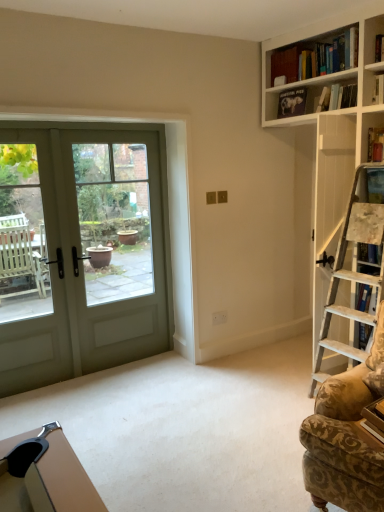
Question: In which direction should I rotate to look at matte black book at upper center, the 2th book from the bottom?

Choices:
 (A) left
 (B) right

Answer: (B)

Question: Would you consider hardcover book at upper right, which ranks as the first book in bottom-to-top order, to be distant from green matte door at left?

Choices:
 (A) no
 (B) yes

Answer: (B)

Question: Does hardcover book at upper right, the 2th book when ordered from top to bottom, have a lesser width compared to green matte door at left?

Choices:
 (A) no
 (B) yes

Answer: (A)

Question: Could you tell me if hardcover book at upper right, acting as the 2th book starting from the left, is facing green matte door at left?

Choices:
 (A) yes
 (B) no

Answer: (B)

Question: Can green matte door at left be found inside hardcover book at upper right, which appears as the first book when viewed from the right?

Choices:
 (A) yes
 (B) no

Answer: (B)

Question: Is hardcover book at upper right, marked as the second book in a back-to-front arrangement, facing away from green matte door at left?

Choices:
 (A) no
 (B) yes

Answer: (A)

Question: Is hardcover book at upper right, the 2th book when ordered from top to bottom, not within green matte door at left?

Choices:
 (A) no
 (B) yes

Answer: (B)

Question: Is patterned fabric rocking chair at right located within hardcover book at upper right, marked as the second book in a back-to-front arrangement?

Choices:
 (A) yes
 (B) no

Answer: (B)

Question: Is hardcover book at upper right, the 1th book positioned from the front, next to patterned fabric rocking chair at right and touching it?

Choices:
 (A) no
 (B) yes

Answer: (A)

Question: Is hardcover book at upper right, which ranks as the first book in bottom-to-top order, oriented towards patterned fabric rocking chair at right?

Choices:
 (A) no
 (B) yes

Answer: (A)

Question: Is hardcover book at upper right, marked as the second book in a back-to-front arrangement, to the left of patterned fabric rocking chair at right from the viewer's perspective?

Choices:
 (A) no
 (B) yes

Answer: (A)

Question: Is hardcover book at upper right, which ranks as the first book in bottom-to-top order, thinner than patterned fabric rocking chair at right?

Choices:
 (A) yes
 (B) no

Answer: (A)

Question: Considering the relative sizes of hardcover book at upper right, which ranks as the first book in bottom-to-top order, and patterned fabric rocking chair at right in the image provided, is hardcover book at upper right, which ranks as the first book in bottom-to-top order, bigger than patterned fabric rocking chair at right?

Choices:
 (A) yes
 (B) no

Answer: (B)

Question: From a real-world perspective, is hardcover book at upper right, acting as the 2th book starting from the left, on top of matte black book at upper center, arranged as the 2th book when viewed from the front?

Choices:
 (A) no
 (B) yes

Answer: (A)